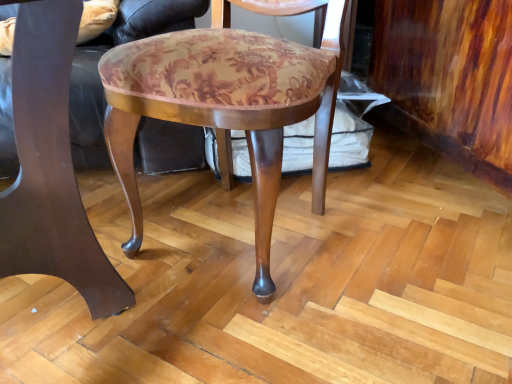
Consider the image. In order to face matte brown wood chair at center, the 1th chair from the left, should I rotate leftwards or rightwards?

Rotate your view left by about 28.969°.

Find the location of `matte brown wood chair at center, the 1th chair from the left`. matte brown wood chair at center, the 1th chair from the left is located at coordinates (51, 167).

What do you see at coordinates (51, 167) in the screenshot?
I see `matte brown wood chair at center, the 1th chair from the left` at bounding box center [51, 167].

At what (x,y) coordinates should I click in order to perform the action: click on wooden chair at center, the first chair when ordered from right to left. Please return your answer as a coordinate pair (x, y). Looking at the image, I should click on (227, 105).

What is the approximate width of wooden chair at center, marked as the second chair in a left-to-right arrangement?

It is 20.45 inches.

The height and width of the screenshot is (384, 512). Describe the element at coordinates (227, 105) in the screenshot. I see `wooden chair at center, marked as the second chair in a left-to-right arrangement` at that location.

What are the coordinates of `matte brown wood chair at center, the 1th chair from the left` in the screenshot? It's located at (51, 167).

Would you say wooden chair at center, the first chair when ordered from right to left, is to the left or to the right of matte brown wood chair at center, arranged as the 2th chair when viewed from the right, in the picture?

Based on their positions, wooden chair at center, the first chair when ordered from right to left, is located to the right of matte brown wood chair at center, arranged as the 2th chair when viewed from the right.

Which object is further away from the camera taking this photo, wooden chair at center, marked as the second chair in a left-to-right arrangement, or matte brown wood chair at center, the 1th chair from the left?

wooden chair at center, marked as the second chair in a left-to-right arrangement.

Is point (115, 117) closer to viewer compared to point (119, 275)?

Yes.

From the image's perspective, is wooden chair at center, marked as the second chair in a left-to-right arrangement, on top of matte brown wood chair at center, the 1th chair from the left?

Yes.

From a real-world perspective, is wooden chair at center, marked as the second chair in a left-to-right arrangement, over matte brown wood chair at center, arranged as the 2th chair when viewed from the right?

Incorrect, from a real-world perspective, wooden chair at center, marked as the second chair in a left-to-right arrangement, is lower than matte brown wood chair at center, arranged as the 2th chair when viewed from the right.

Considering the relative sizes of wooden chair at center, marked as the second chair in a left-to-right arrangement, and matte brown wood chair at center, arranged as the 2th chair when viewed from the right, in the image provided, is wooden chair at center, marked as the second chair in a left-to-right arrangement, wider than matte brown wood chair at center, arranged as the 2th chair when viewed from the right,?

No.

Is wooden chair at center, the first chair when ordered from right to left, taller or shorter than matte brown wood chair at center, the 1th chair from the left?

Considering their sizes, wooden chair at center, the first chair when ordered from right to left, has less height than matte brown wood chair at center, the 1th chair from the left.

Is wooden chair at center, the first chair when ordered from right to left, bigger than matte brown wood chair at center, the 1th chair from the left?

Yes.

Consider the image. Is wooden chair at center, the first chair when ordered from right to left, positioned beyond the bounds of matte brown wood chair at center, arranged as the 2th chair when viewed from the right?

That's correct, wooden chair at center, the first chair when ordered from right to left, is outside of matte brown wood chair at center, arranged as the 2th chair when viewed from the right.

Consider the image. Is wooden chair at center, marked as the second chair in a left-to-right arrangement, positioned far away from matte brown wood chair at center, the 1th chair from the left?

They are positioned close to each other.

Is matte brown wood chair at center, arranged as the 2th chair when viewed from the right, at the back of wooden chair at center, marked as the second chair in a left-to-right arrangement?

No.

Find the location of a particular element. This screenshot has width=512, height=384. chair positioned vertically above the wooden chair at center, the first chair when ordered from right to left (from a real-world perspective) is located at coordinates (51, 167).

Would you say matte brown wood chair at center, arranged as the 2th chair when viewed from the right, is to the left or to the right of wooden chair at center, marked as the second chair in a left-to-right arrangement, in the picture?

Clearly, matte brown wood chair at center, arranged as the 2th chair when viewed from the right, is on the left of wooden chair at center, marked as the second chair in a left-to-right arrangement, in the image.

Is the position of matte brown wood chair at center, the 1th chair from the left, more distant than that of wooden chair at center, marked as the second chair in a left-to-right arrangement?

No, it is not.

Is point (63, 0) closer to viewer compared to point (306, 1)?

Yes, it is.

From the image's perspective, is matte brown wood chair at center, arranged as the 2th chair when viewed from the right, above or below wooden chair at center, the first chair when ordered from right to left?

Based on their image positions, matte brown wood chair at center, arranged as the 2th chair when viewed from the right, is located beneath wooden chair at center, the first chair when ordered from right to left.

From a real-world perspective, is matte brown wood chair at center, arranged as the 2th chair when viewed from the right, located beneath wooden chair at center, marked as the second chair in a left-to-right arrangement?

No.

Is matte brown wood chair at center, arranged as the 2th chair when viewed from the right, wider than wooden chair at center, marked as the second chair in a left-to-right arrangement?

Yes.

Considering the sizes of objects matte brown wood chair at center, arranged as the 2th chair when viewed from the right, and wooden chair at center, the first chair when ordered from right to left, in the image provided, who is shorter, matte brown wood chair at center, arranged as the 2th chair when viewed from the right, or wooden chair at center, the first chair when ordered from right to left,?

With less height is wooden chair at center, the first chair when ordered from right to left.

Does matte brown wood chair at center, the 1th chair from the left, have a larger size compared to wooden chair at center, the first chair when ordered from right to left?

No.

Choose the correct answer: Is matte brown wood chair at center, the 1th chair from the left, inside wooden chair at center, the first chair when ordered from right to left, or outside it?

matte brown wood chair at center, the 1th chair from the left, is not inside wooden chair at center, the first chair when ordered from right to left, it's outside.

Is matte brown wood chair at center, arranged as the 2th chair when viewed from the right, beside wooden chair at center, marked as the second chair in a left-to-right arrangement?

They are not placed beside each other.

Does matte brown wood chair at center, arranged as the 2th chair when viewed from the right, turn towards wooden chair at center, marked as the second chair in a left-to-right arrangement?

No, matte brown wood chair at center, arranged as the 2th chair when viewed from the right, is not facing towards wooden chair at center, marked as the second chair in a left-to-right arrangement.

Could you measure the distance between matte brown wood chair at center, the 1th chair from the left, and wooden chair at center, marked as the second chair in a left-to-right arrangement?

A distance of 26.17 centimeters exists between matte brown wood chair at center, the 1th chair from the left, and wooden chair at center, marked as the second chair in a left-to-right arrangement.

At what (x,y) coordinates should I click in order to perform the action: click on chair above the matte brown wood chair at center, the 1th chair from the left (from the image's perspective). Please return your answer as a coordinate pair (x, y). Looking at the image, I should click on (227, 105).

Where is `chair lying in front of the wooden chair at center, the first chair when ordered from right to left`? The width and height of the screenshot is (512, 384). chair lying in front of the wooden chair at center, the first chair when ordered from right to left is located at coordinates (51, 167).

You are a GUI agent. You are given a task and a screenshot of the screen. Output one action in this format:
    pyautogui.click(x=<x>, y=<y>)
    Task: Click on the chair directly beneath the matte brown wood chair at center, arranged as the 2th chair when viewed from the right (from a real-world perspective)
    The image size is (512, 384).
    Given the screenshot: What is the action you would take?
    pyautogui.click(x=227, y=105)